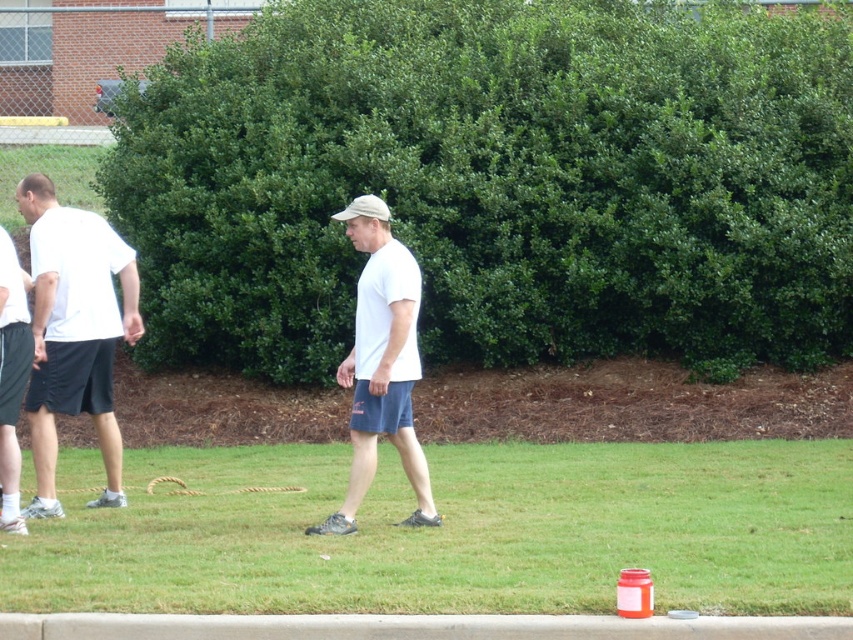
Is green grass at lower center positioned at the back of white matte shirt at center?

No, it is in front of white matte shirt at center.

Identify the location of green grass at lower center. (451, 531).

Find the location of a particular element. green grass at lower center is located at coordinates (451, 531).

Who is more distant from viewer, (55, 458) or (412, 445)?

The point (55, 458) is behind.

Does white matte shorts at left have a greater height compared to white matte shirt at center?

Indeed, white matte shorts at left has a greater height compared to white matte shirt at center.

Find the location of a particular element. The width and height of the screenshot is (853, 640). white matte shorts at left is located at coordinates (74, 332).

Where is `white matte shorts at left`? The width and height of the screenshot is (853, 640). white matte shorts at left is located at coordinates (74, 332).

Who is more forward, [213,348] or [337,513]?

Point [337,513] is in front.

Is green leafy bush at center above white matte shirt at center?

Yes, green leafy bush at center is above white matte shirt at center.

Does point (366, 108) lie in front of point (361, 406)?

No, (366, 108) is further to viewer.

Where is `green leafy bush at center`? Image resolution: width=853 pixels, height=640 pixels. green leafy bush at center is located at coordinates (498, 182).